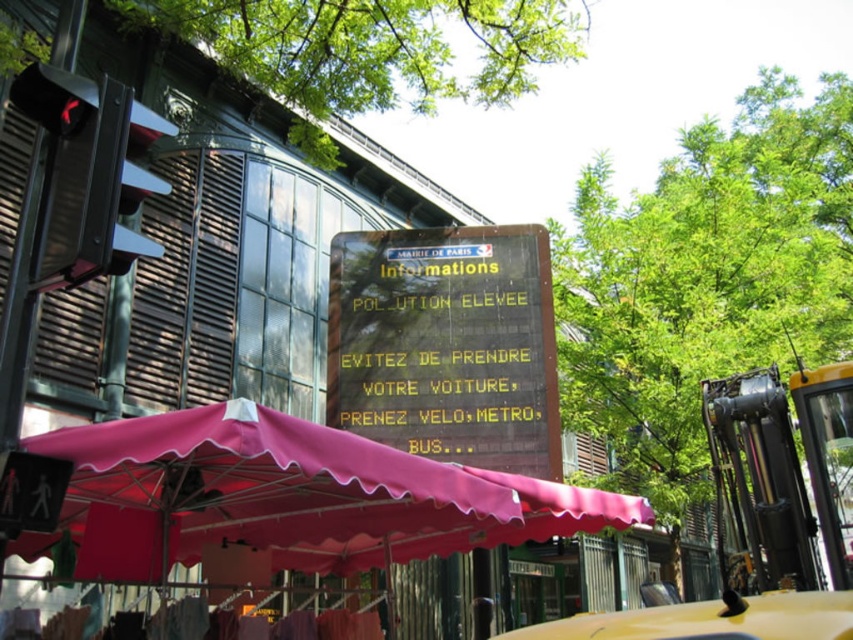
Based on the scene description, where exactly is the wooden signboard at center located?

The wooden signboard at center is located at point [445,344].

You are a tourist in Paris and want to read the information on the wooden signboard at center. There is a yellow rubber taxi at lower right nearby. Which object is bigger?

The wooden signboard at center is larger in size than the yellow rubber taxi at lower right.